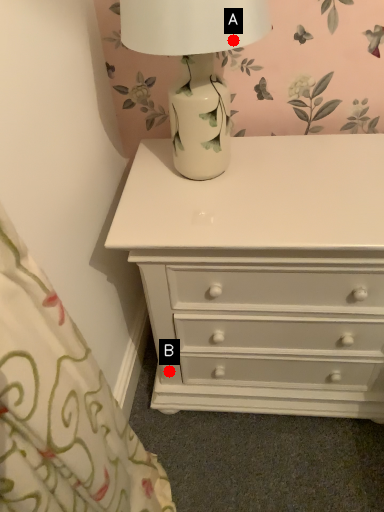
Question: Two points are circled on the image, labeled by A and B beside each circle. Among these points, which one is nearest to the camera?

Choices:
 (A) A is closer
 (B) B is closer

Answer: (A)